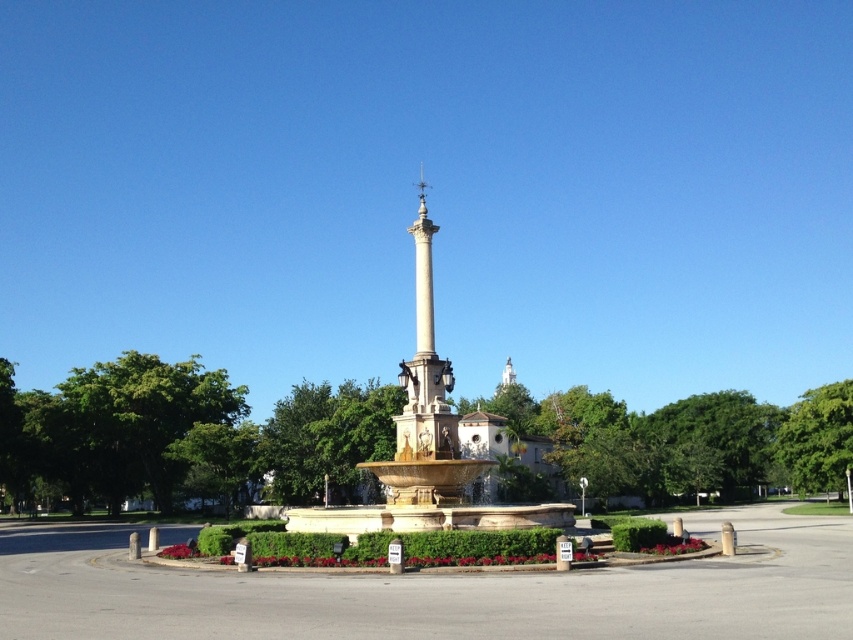
Can you confirm if golden stone fountain at center is taller than beige stone column at center?

Indeed, golden stone fountain at center has a greater height compared to beige stone column at center.

Does golden stone fountain at center appear over beige stone column at center?

Incorrect, golden stone fountain at center is not positioned above beige stone column at center.

The height and width of the screenshot is (640, 853). I want to click on golden stone fountain at center, so click(426, 445).